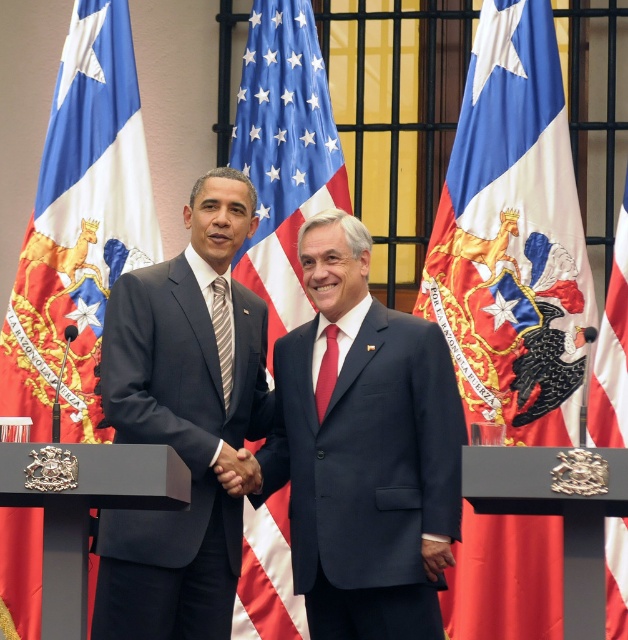
Question: Which of the following is the farthest from the observer?

Choices:
 (A) blue fabric flag at left
 (B) red satin tie at center
 (C) matte black suit at left
 (D) american flag at center

Answer: (D)

Question: Which point is closer to the camera taking this photo?

Choices:
 (A) (433, 227)
 (B) (133, 616)

Answer: (B)

Question: Does red fabric flag at center come in front of striped fabric tie at center?

Choices:
 (A) yes
 (B) no

Answer: (A)

Question: Is silk flag at center bigger than navy blue suit at center?

Choices:
 (A) no
 (B) yes

Answer: (B)

Question: Considering the relative positions of american flag at center and black matte hand at center in the image provided, where is american flag at center located with respect to black matte hand at center?

Choices:
 (A) left
 (B) right

Answer: (B)

Question: Which object appears farthest from the camera in this image?

Choices:
 (A) matte black suit at left
 (B) striped fabric tie at center

Answer: (B)